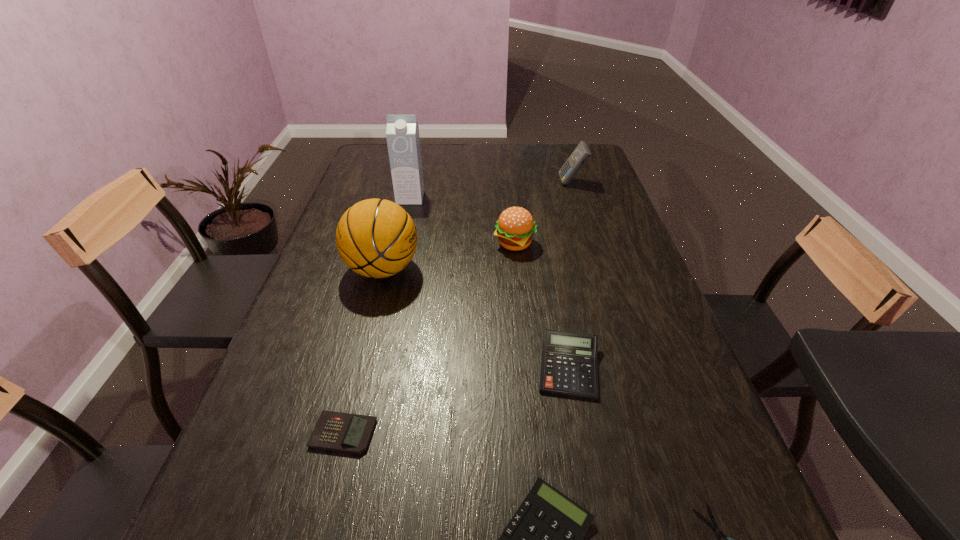
Select which object appears as the fifth closest to the seventh shortest object. Please provide its 2D coordinates. Your answer should be formatted as a tuple, i.e. [(x, y)], where the tuple contains the x and y coordinates of a point satisfying the conditions above.

[(544, 539)]

Where is `object that stands as the seventh closest to the sixth farthest object`? Image resolution: width=960 pixels, height=540 pixels. object that stands as the seventh closest to the sixth farthest object is located at coordinates (580, 155).

Choose which calculator is the third nearest neighbor to the third nearest calculator. Please provide its 2D coordinates. Your answer should be formatted as a tuple, i.e. [(x, y)], where the tuple contains the x and y coordinates of a point satisfying the conditions above.

[(580, 155)]

At what (x,y) coordinates should I click in order to perform the action: click on calculator object that ranks as the closest to the third nearest object. Please return your answer as a coordinate pair (x, y). Looking at the image, I should click on (544, 539).

Locate an element on the screen. vacant space that satisfies the following two spatial constraints: 1. on the front label of the fourth shortest object; 2. on the right side of the tallest object is located at coordinates (372, 368).

This screenshot has height=540, width=960. I want to click on vacant area in the image that satisfies the following two spatial constraints: 1. on the surface of the second farthest calculator near the brand logo; 2. on the right side of the second tallest object, so click(357, 368).

At what (x,y) coordinates should I click in order to perform the action: click on free space that satisfies the following two spatial constraints: 1. on the surface of the second tallest object near the brand logo; 2. on the left side of the third nearest object. Please return your answer as a coordinate pair (x, y). Looking at the image, I should click on (341, 433).

You are a GUI agent. You are given a task and a screenshot of the screen. Output one action in this format:
    pyautogui.click(x=<x>, y=<y>)
    Task: Click on the vacant position in the image that satisfies the following two spatial constraints: 1. on the back side of the second nearest calculator; 2. on the surface of the basketball near the brand logo
    Image resolution: width=960 pixels, height=540 pixels.
    Given the screenshot: What is the action you would take?
    pyautogui.click(x=385, y=269)

Locate an element on the screen. The image size is (960, 540). vacant space that satisfies the following two spatial constraints: 1. on the front label of the second farthest object; 2. on the surface of the basketball near the brand logo is located at coordinates (395, 269).